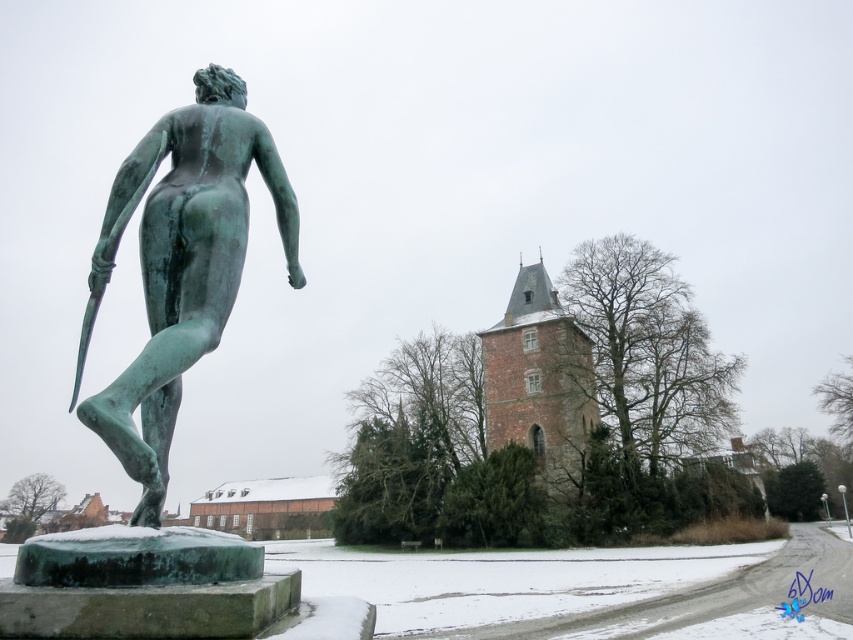
You are standing at the center of the winter scene. There is a point marked at coordinates (x=183, y=262). What object is located at that point?

The point at coordinates (x=183, y=262) marks the green patina bronze statue at left.

You are standing in the winter scene and want to take a photo of both the green patina bronze statue at left and the brown wooden church at center. Which object should you focus on first to ensure both are in sharp focus?

You should focus on the green patina bronze statue at left first because it is closer to you than the brown wooden church at center, so adjusting focus from near to far will help both be in sharp focus.

You are an art student who wants to draw the winter scene. You notice the green patina bronze statue at left and the brown wooden church at center. Which object is located to the left of the other?

The green patina bronze statue at left is positioned on the left side of brown wooden church at center.